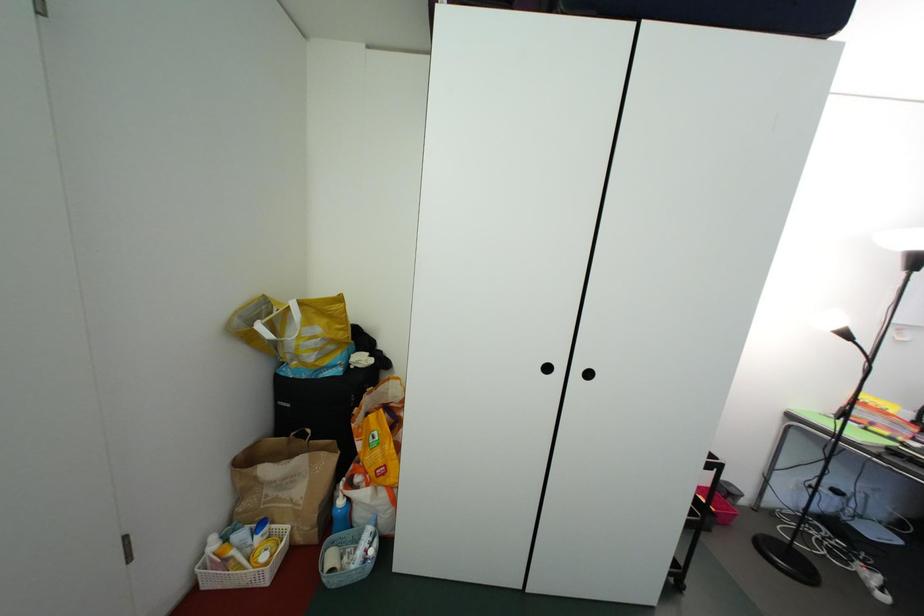
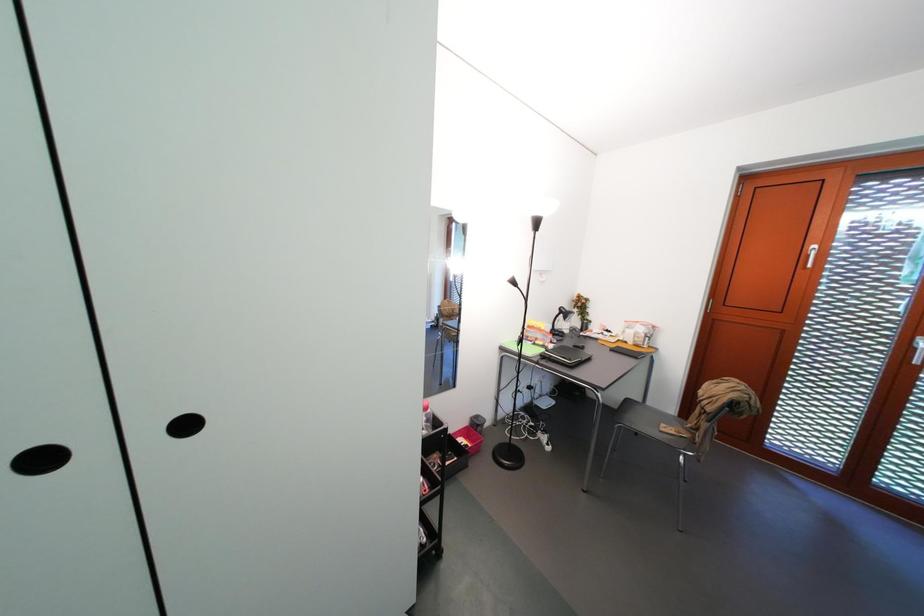
Question: The camera is either moving clockwise (left) or counter-clockwise (right) around the object. The first image is from the beginning of the video and the second image is from the end. Is the camera moving left or right when shooting the video?

Choices:
 (A) Left
 (B) Right

Answer: (A)